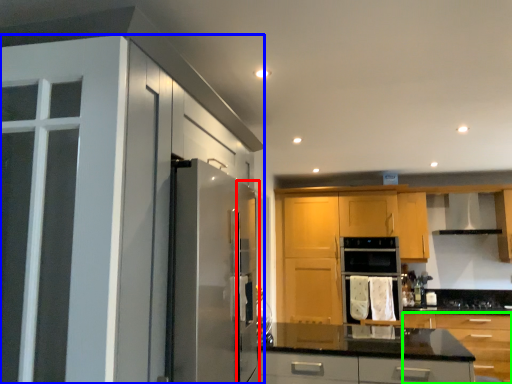
Question: Based on their relative distances, which object is nearer to screen door (highlighted by a red box)? Choose from cabinetry (highlighted by a blue box) and cabinetry (highlighted by a green box).

Choices:
 (A) cabinetry
 (B) cabinetry

Answer: (A)